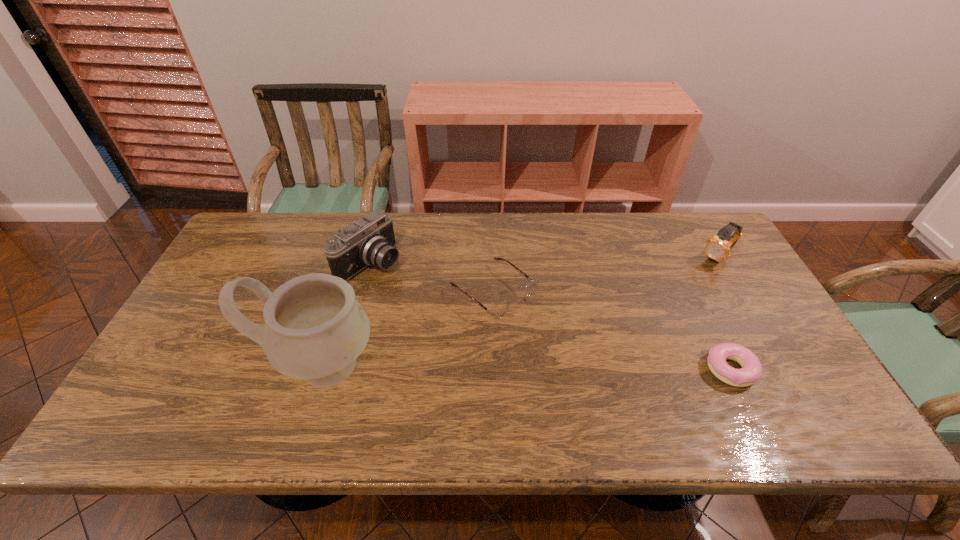
The width and height of the screenshot is (960, 540). I want to click on vacant space that is in between the camera and the rightmost object, so click(544, 260).

Find the location of a particular element. the fourth closest object to the rightmost object is located at coordinates (315, 329).

You are a GUI agent. You are given a task and a screenshot of the screen. Output one action in this format:
    pyautogui.click(x=<x>, y=<y>)
    Task: Click on the second closest object to the shortest object
    This screenshot has width=960, height=540.
    Given the screenshot: What is the action you would take?
    pyautogui.click(x=499, y=310)

This screenshot has width=960, height=540. What are the coordinates of `free location that satisfies the following two spatial constraints: 1. on the back side of the camera; 2. on the left side of the third shortest object` in the screenshot? It's located at (372, 259).

Locate an element on the screen. This screenshot has width=960, height=540. vacant space that satisfies the following two spatial constraints: 1. on the front side of the shortest object; 2. on the right side of the second shortest object is located at coordinates (493, 369).